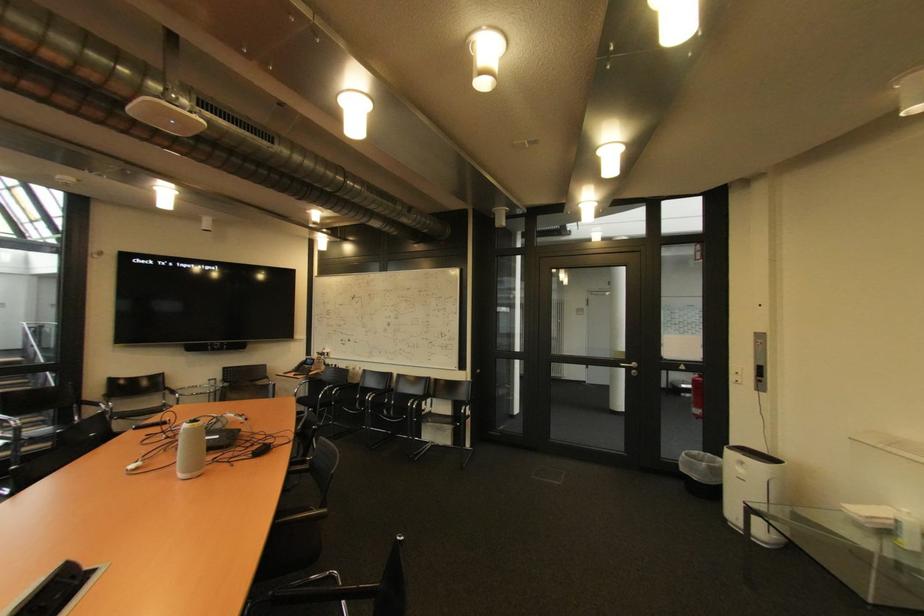
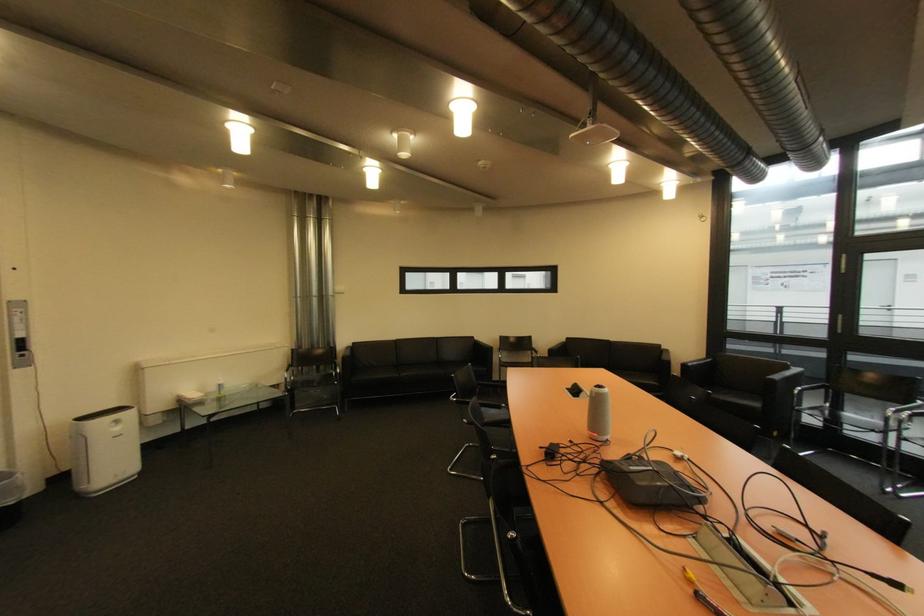
Locate, in the second image, the point that corresponds to point (748, 471) in the first image.

(124, 430)